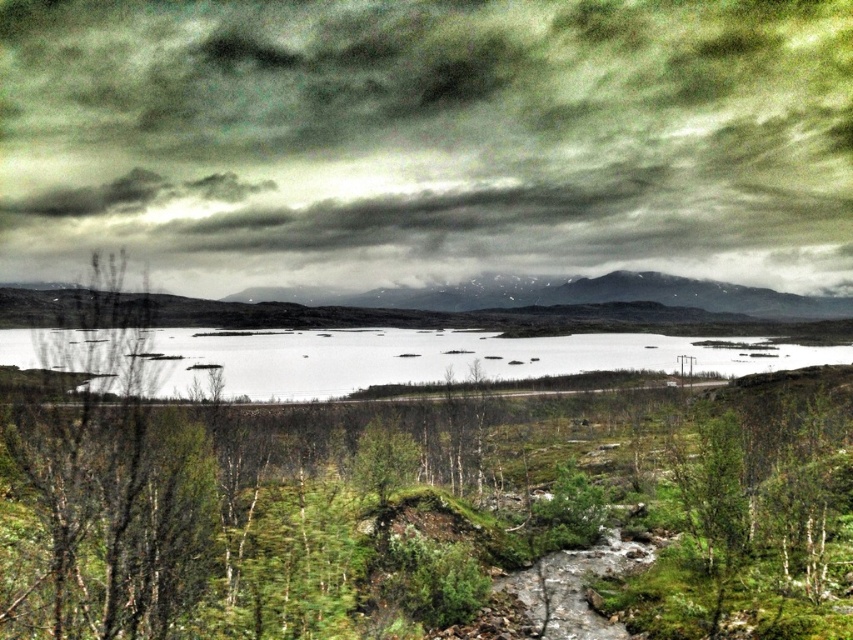
Question: Which point is closer to the camera?

Choices:
 (A) (171, 145)
 (B) (113, 440)
 (C) (238, 378)

Answer: (B)

Question: Where is cloudy sky at upper center located in relation to white smooth water at center in the image?

Choices:
 (A) above
 (B) below

Answer: (A)

Question: Does cloudy sky at upper center have a lesser width compared to white smooth water at center?

Choices:
 (A) no
 (B) yes

Answer: (A)

Question: Which point is closer to the camera?

Choices:
 (A) [360, 20]
 (B) [105, 342]

Answer: (B)

Question: Does green leafy shrubs at center have a greater width compared to white smooth water at center?

Choices:
 (A) no
 (B) yes

Answer: (A)

Question: Which of the following is the farthest from the observer?

Choices:
 (A) cloudy sky at upper center
 (B) white smooth water at center
 (C) green leafy shrubs at center

Answer: (A)